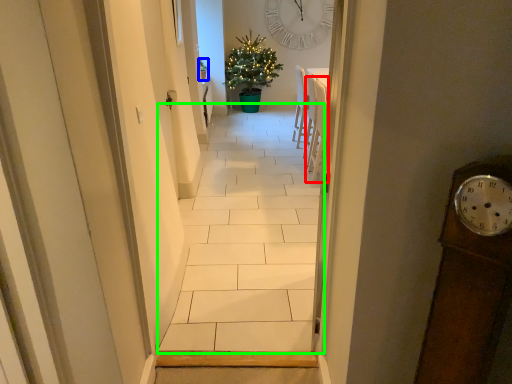
Question: Estimate the real-world distances between objects in this image. Which object is closer to chair (highlighted by a red box), houseplant (highlighted by a blue box) or path (highlighted by a green box)?

Choices:
 (A) houseplant
 (B) path

Answer: (B)